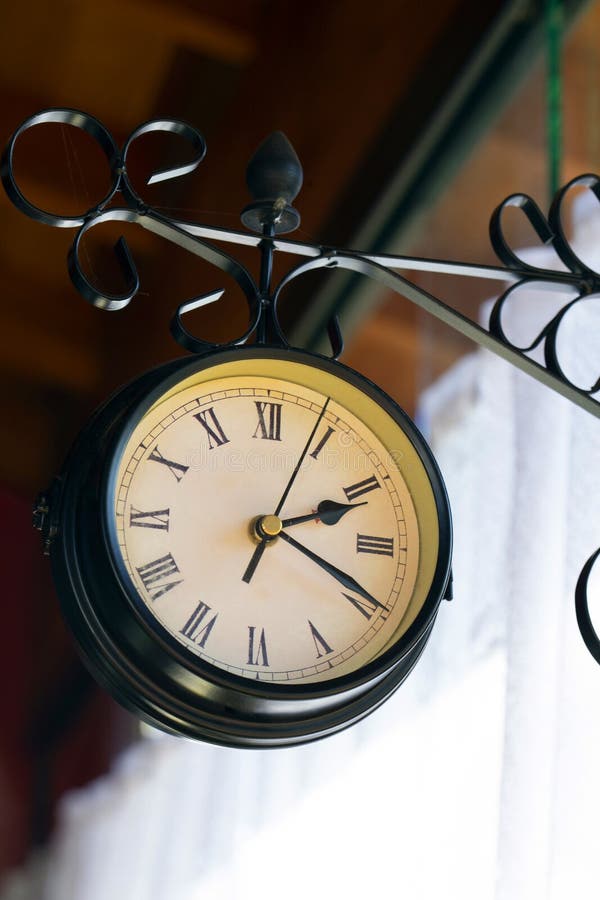
Identify the location of black metal decor piece that clock is hanging from. The width and height of the screenshot is (600, 900). 167,226, 518,356.